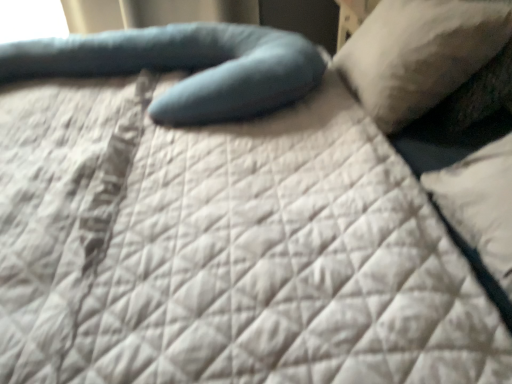
Question: In terms of size, does white soft pillow at upper right, which ranks as the second pillow in left-to-right order, appear bigger or smaller than teal fabric pillow at center, marked as the second pillow in a right-to-left arrangement?

Choices:
 (A) small
 (B) big

Answer: (A)

Question: From a real-world perspective, is white soft pillow at upper right, which ranks as the second pillow in left-to-right order, above or below teal fabric pillow at center, marked as the second pillow in a right-to-left arrangement?

Choices:
 (A) below
 (B) above

Answer: (B)

Question: Relative to teal fabric pillow at center, marked as the second pillow in a right-to-left arrangement, is white soft pillow at upper right, which ranks as the second pillow in left-to-right order, in front or behind?

Choices:
 (A) behind
 (B) front

Answer: (B)

Question: Would you say teal fabric pillow at center, marked as the second pillow in a right-to-left arrangement, is inside or outside white soft pillow at upper right, acting as the first pillow starting from the right?

Choices:
 (A) inside
 (B) outside

Answer: (B)

Question: From a real-world perspective, relative to white soft pillow at upper right, acting as the first pillow starting from the right, is teal fabric pillow at center, marked as the second pillow in a right-to-left arrangement, vertically above or below?

Choices:
 (A) below
 (B) above

Answer: (A)

Question: Considering the relative positions of teal fabric pillow at center, marked as the second pillow in a right-to-left arrangement, and white soft pillow at upper right, which ranks as the second pillow in left-to-right order, in the image provided, is teal fabric pillow at center, marked as the second pillow in a right-to-left arrangement, to the left or to the right of white soft pillow at upper right, which ranks as the second pillow in left-to-right order,?

Choices:
 (A) right
 (B) left

Answer: (B)

Question: From the image's perspective, is teal fabric pillow at center, the 1th pillow viewed from the left, positioned above or below white soft pillow at upper right, acting as the first pillow starting from the right?

Choices:
 (A) above
 (B) below

Answer: (B)